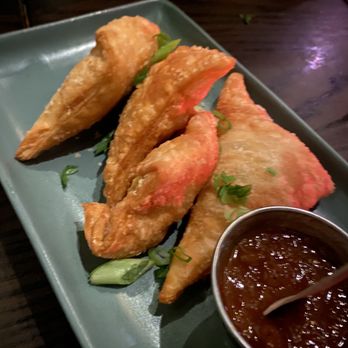
Find the location of a particular element. This screenshot has height=348, width=348. wooden table top is located at coordinates (20, 315), (314, 28).